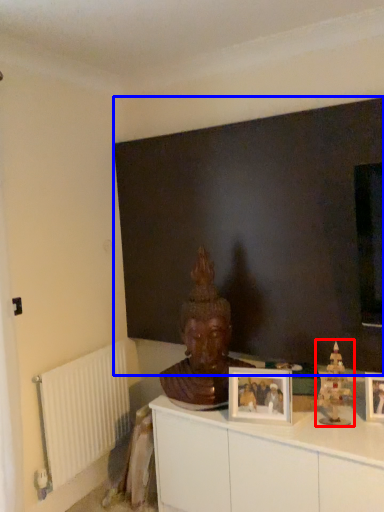
Question: Which object appears farthest to the camera in this image, toy (highlighted by a red box) or backdrop (highlighted by a blue box)?

Choices:
 (A) toy
 (B) backdrop

Answer: (B)